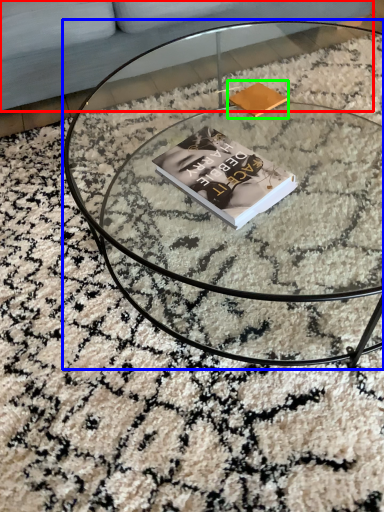
Question: Which is farther away from couch (highlighted by a red box)? coffee table (highlighted by a blue box) or paperback book (highlighted by a green box)?

Choices:
 (A) coffee table
 (B) paperback book

Answer: (B)